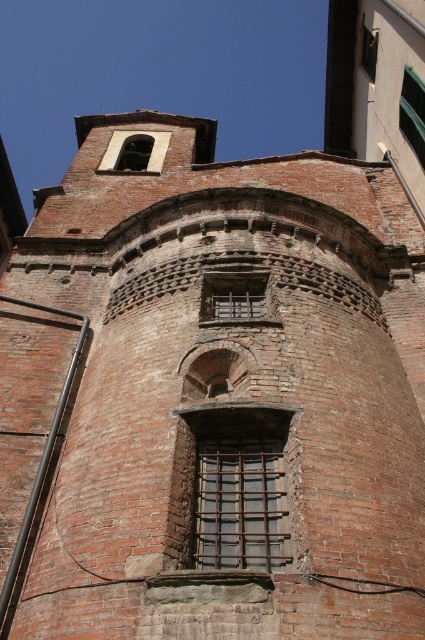
You are an architect assessing the structural integrity of the historic brick building. You notice the green glass window at upper right and the matte brick window at upper center. Which window is taller?

The green glass window at upper right is taller than the matte brick window at upper center according to the description.

You are an architect assessing the structural integrity of the building. You notice two elements in the image. The first is the rusty metal bars at center, and the second is the matte brick bell tower at upper center. Which of these two elements is more likely to require immediate attention due to size constraints related to their structural roles?

The rusty metal bars at center is smaller than the matte brick bell tower at upper center, so the rusty metal bars at center may require immediate attention as they might be insufficient in size to adequately support the structural demands placed on them.